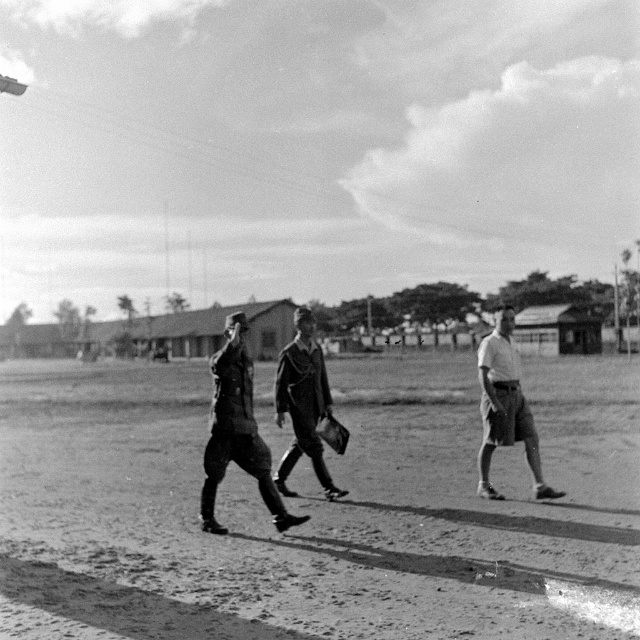
Is point (234, 333) positioned in front of point (520, 426)?

Yes, point (234, 333) is closer to viewer.

Locate an element on the screen. The width and height of the screenshot is (640, 640). dark gray uniform at center is located at coordinates (236, 429).

The height and width of the screenshot is (640, 640). Describe the element at coordinates (236, 429) in the screenshot. I see `dark gray uniform at center` at that location.

Which is more to the right, dark gray uniform at center or uniformed man at center?

Positioned to the right is uniformed man at center.

Is point (246, 416) farther from camera compared to point (292, 456)?

No.

Find the location of `dark gray uniform at center`. dark gray uniform at center is located at coordinates (236, 429).

Does point (445, 604) lie behind point (484, 474)?

No.

Does dirt field at center appear on the left side of light gray shorts at right?

Indeed, dirt field at center is positioned on the left side of light gray shorts at right.

You are a GUI agent. You are given a task and a screenshot of the screen. Output one action in this format:
    pyautogui.click(x=<x>, y=<y>)
    Task: Click on the dirt field at center
    This screenshot has width=640, height=640.
    Given the screenshot: What is the action you would take?
    pyautogui.click(x=317, y=509)

Find the location of a particular element. The width and height of the screenshot is (640, 640). dirt field at center is located at coordinates (317, 509).